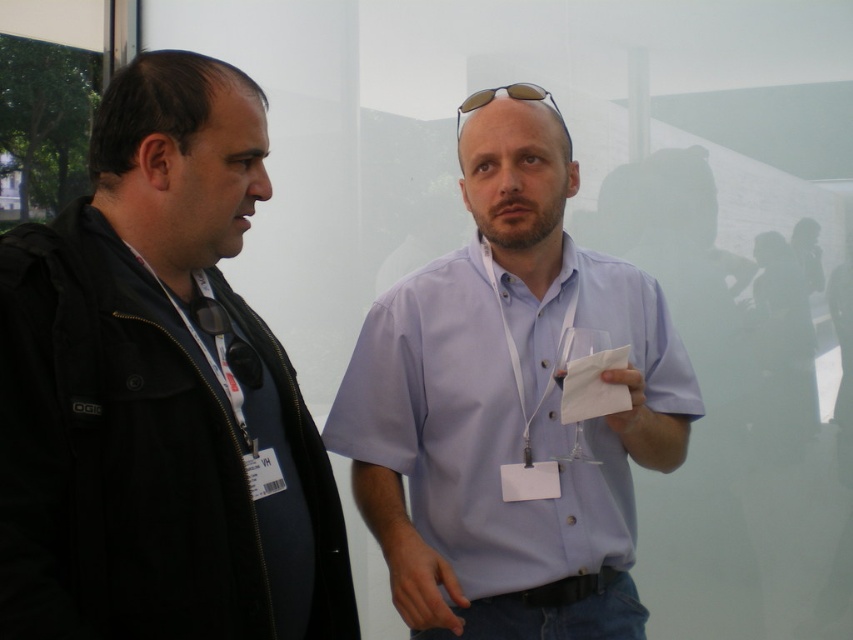
Based on the photo, you are standing in the room and want to hand a document to the person wearing the light blue shirt at center. Which direction should you move to approach them from the black matte jacket at left?

The black matte jacket at left is to the left of the light blue shirt at center, so you should move to the right to approach the light blue shirt at center from the black matte jacket at left.

In the scene shown: Imagine you are standing in the room and looking at the two points marked in the image. Which point, point (134, 557) or point (639, 388), is nearer to you?

Point (134, 557) is closer to the viewer than point (639, 388).